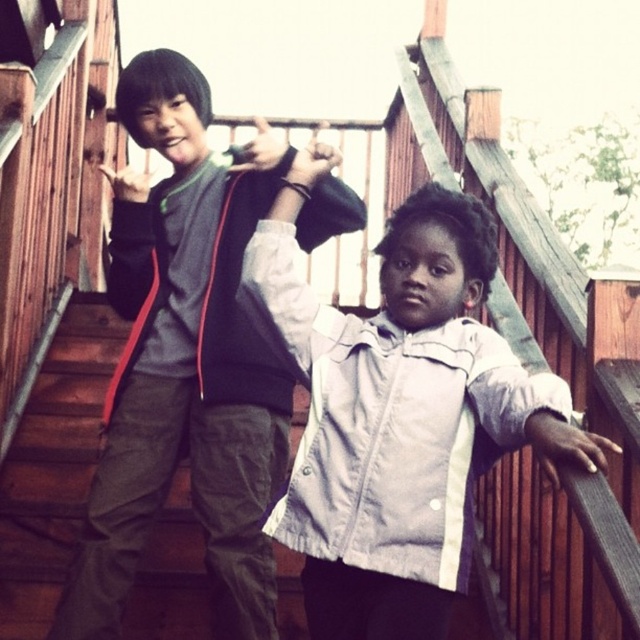
This screenshot has width=640, height=640. What do you see at coordinates (396, 410) in the screenshot?
I see `white matte jacket at center` at bounding box center [396, 410].

Does point (465, 259) come behind point (136, 68)?

No, (465, 259) is closer to viewer.

Where is `white matte jacket at center`? white matte jacket at center is located at coordinates (396, 410).

In order to click on white matte jacket at center in this screenshot , I will do `click(396, 410)`.